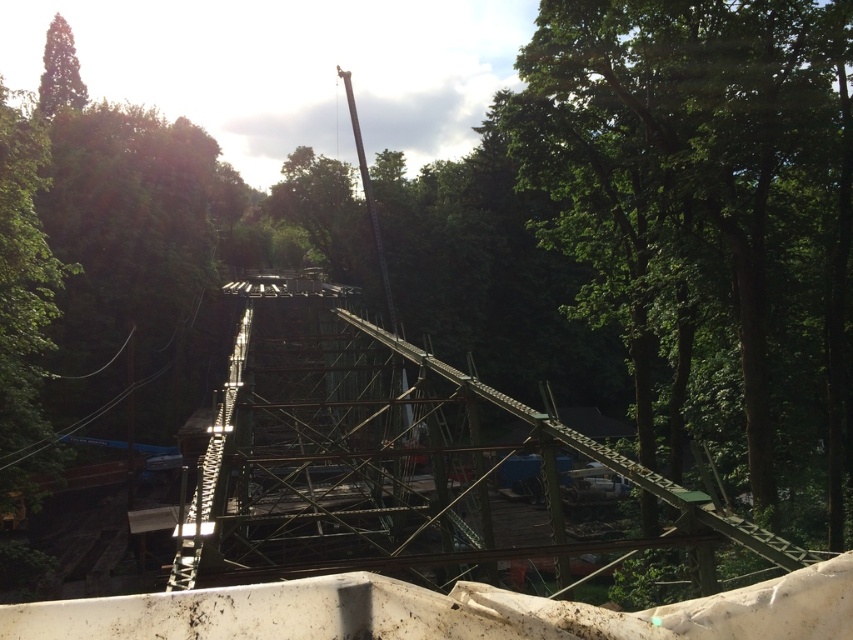
Question: Among these objects, which one is farthest from the camera?

Choices:
 (A) green leafy tree at center
 (B) green leafy tree at upper left

Answer: (B)

Question: Which point appears farthest from the camera in this image?

Choices:
 (A) (704, 172)
 (B) (62, 58)

Answer: (B)

Question: Can you confirm if green leafy tree at center is positioned above green leafy tree at upper left?

Choices:
 (A) no
 (B) yes

Answer: (A)

Question: Observing the image, what is the correct spatial positioning of green leafy tree at center in reference to green leafy tree at upper left?

Choices:
 (A) right
 (B) left

Answer: (A)

Question: Which object appears farthest from the camera in this image?

Choices:
 (A) green leafy tree at upper left
 (B) green leafy tree at center

Answer: (A)

Question: Can you confirm if green leafy tree at center is positioned to the left of green leafy tree at upper left?

Choices:
 (A) yes
 (B) no

Answer: (B)